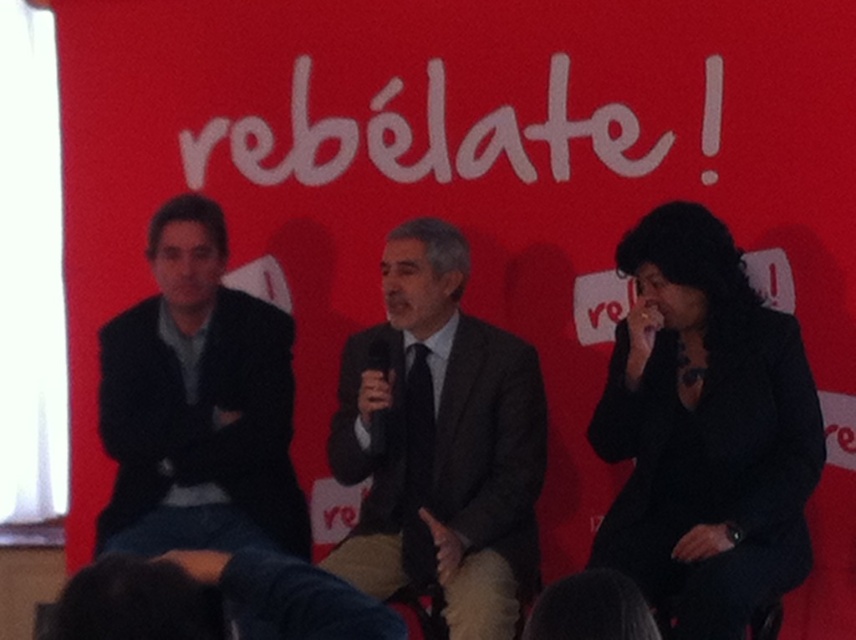
You are designing a layout for a poster and need to place the dark gray suit at left and the white matte text at center. Based on their widths, which one should be placed on the left side of the poster to ensure proper alignment?

The dark gray suit at left is thinner than the white matte text at center, so placing the thinner dark gray suit at left on the left side would allow the wider white matte text at center to be centered properly.

You are a photographer adjusting the camera focus. You need to ensure that both the dark gray suit at center and the white matte text at center are in focus. Given their relative heights, which object should you focus on first to ensure both are sharp?

The dark gray suit at center has a greater height compared to the white matte text at center, so focusing on the taller dark gray suit at center first will help ensure both are in focus.

In the scene shown: You are a photographer setting up a shoot. You need to adjust the lighting so that the black fabric at right and the dark gray suit at left are illuminated equally. Which object requires more light to achieve this balance?

The black fabric at right requires more light because it is much taller than the dark gray suit at left, so it needs more illumination to match the brightness.